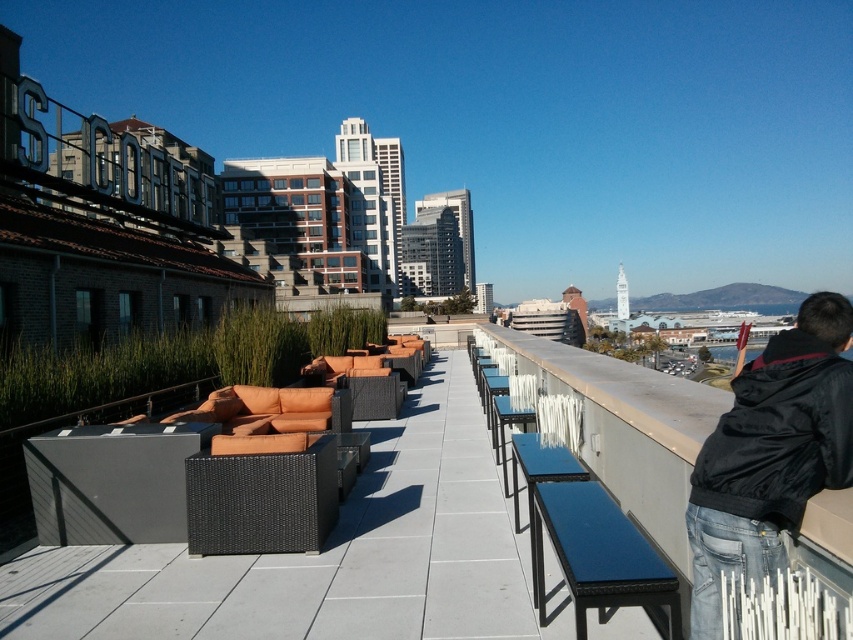
Question: Is black matte jacket at upper right smaller than blue plastic bench at right?

Choices:
 (A) no
 (B) yes

Answer: (A)

Question: Which object appears farthest from the camera in this image?

Choices:
 (A) blue plastic bench at right
 (B) black matte jacket at upper right

Answer: (B)

Question: Is black matte jacket at upper right wider than blue plastic bench at right?

Choices:
 (A) no
 (B) yes

Answer: (B)

Question: Can you confirm if black matte jacket at upper right is positioned to the right of blue plastic bench at right?

Choices:
 (A) no
 (B) yes

Answer: (B)